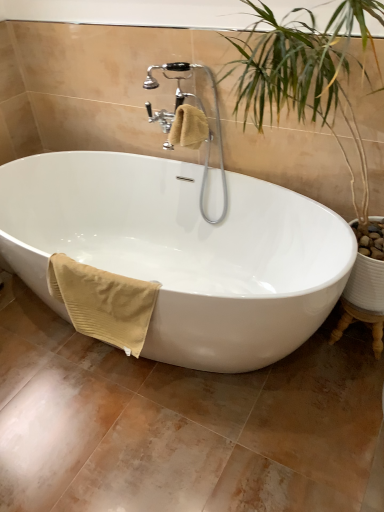
Question: From a real-world perspective, is beige cotton towel at upper center, placed as the first bath towel when sorted from top to bottom, positioned under white glossy bathtub at center based on gravity?

Choices:
 (A) yes
 (B) no

Answer: (B)

Question: Is beige cotton towel at upper center, placed as the first bath towel when sorted from right to left, aimed at white glossy bathtub at center?

Choices:
 (A) no
 (B) yes

Answer: (A)

Question: Are beige cotton towel at upper center, the second bath towel in the bottom-to-top sequence, and white glossy bathtub at center making contact?

Choices:
 (A) yes
 (B) no

Answer: (B)

Question: Considering the relative sizes of beige cotton towel at upper center, placed as the first bath towel when sorted from top to bottom, and white glossy bathtub at center in the image provided, is beige cotton towel at upper center, placed as the first bath towel when sorted from top to bottom, shorter than white glossy bathtub at center?

Choices:
 (A) no
 (B) yes

Answer: (B)

Question: Is beige cotton towel at upper center, placed as the first bath towel when sorted from right to left, facing away from white glossy bathtub at center?

Choices:
 (A) no
 (B) yes

Answer: (A)

Question: Visually, is white glossy bathtub at center positioned to the left or to the right of beige ribbed towel at lower left, acting as the first bath towel starting from the bottom?

Choices:
 (A) right
 (B) left

Answer: (A)

Question: Considering the positions of white glossy bathtub at center and beige ribbed towel at lower left, which is the second bath towel in right-to-left order, in the image, is white glossy bathtub at center bigger or smaller than beige ribbed towel at lower left, which is the second bath towel in right-to-left order,?

Choices:
 (A) big
 (B) small

Answer: (A)

Question: Is white glossy bathtub at center inside the boundaries of beige ribbed towel at lower left, acting as the first bath towel starting from the bottom, or outside?

Choices:
 (A) inside
 (B) outside

Answer: (B)

Question: In terms of width, does white glossy bathtub at center look wider or thinner when compared to beige ribbed towel at lower left, acting as the first bath towel starting from the bottom?

Choices:
 (A) thin
 (B) wide

Answer: (B)

Question: Visually, is polished chrome faucet at upper center positioned to the left or to the right of beige ribbed towel at lower left, which is counted as the 1th bath towel, starting from the left?

Choices:
 (A) left
 (B) right

Answer: (B)

Question: From the image's perspective, relative to beige ribbed towel at lower left, which is counted as the 1th bath towel, starting from the left, is polished chrome faucet at upper center above or below?

Choices:
 (A) below
 (B) above

Answer: (B)

Question: In terms of size, does polished chrome faucet at upper center appear bigger or smaller than beige ribbed towel at lower left, which is the second bath towel in right-to-left order?

Choices:
 (A) small
 (B) big

Answer: (B)

Question: Relative to beige ribbed towel at lower left, acting as the first bath towel starting from the bottom, is polished chrome faucet at upper center in front or behind?

Choices:
 (A) behind
 (B) front

Answer: (A)

Question: Considering their positions, is polished chrome faucet at upper center located in front of or behind white glossy bathtub at center?

Choices:
 (A) behind
 (B) front

Answer: (A)

Question: Does point (160, 67) appear closer or farther from the camera than point (284, 222)?

Choices:
 (A) closer
 (B) farther

Answer: (A)